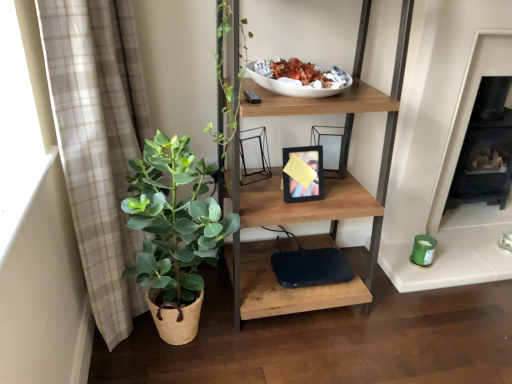
Question: Is green leafy plant in woven basket at left spatially inside wooden shelf at center, or outside of it?

Choices:
 (A) inside
 (B) outside

Answer: (B)

Question: Considering the positions of green leafy plant in woven basket at left and wooden shelf at center in the image, is green leafy plant in woven basket at left taller or shorter than wooden shelf at center?

Choices:
 (A) tall
 (B) short

Answer: (B)

Question: Which of these objects is positioned closest to the black matte fireplace at right?

Choices:
 (A) beige plaid curtain at left
 (B) wooden shelf at center
 (C) green leafy plant in woven basket at left

Answer: (B)

Question: Which object is the closest to the green leafy plant in woven basket at left?

Choices:
 (A) beige plaid curtain at left
 (B) black matte fireplace at right
 (C) wooden shelf at center

Answer: (A)